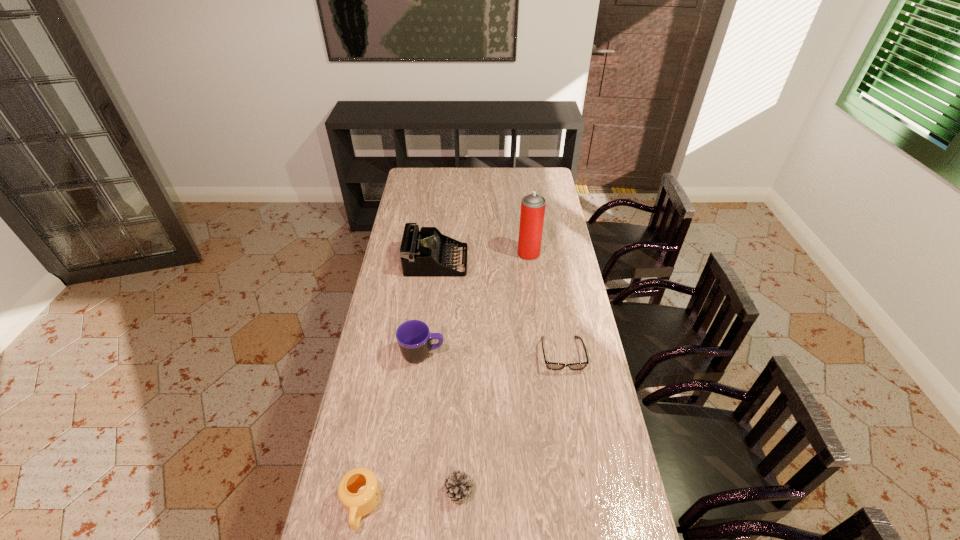
Identify the location of vacant area that lies between the fourth tallest object and the farther mug. (392, 430).

Where is `free space between the typewriter and the pinecone`? free space between the typewriter and the pinecone is located at coordinates (448, 376).

Find the location of a particular element. blank region between the farther mug and the pinecone is located at coordinates (441, 422).

Find the location of a particular element. Image resolution: width=960 pixels, height=540 pixels. free spot between the farther mug and the shortest object is located at coordinates pos(492,354).

This screenshot has width=960, height=540. What are the coordinates of `vacant space that's between the typewriter and the taller mug` in the screenshot? It's located at (429, 308).

Locate an element on the screen. free spot between the spectacles and the taller mug is located at coordinates (492, 354).

I want to click on unoccupied position between the fifth tallest object and the aerosol can, so click(494, 372).

Find the location of a particular element. Image resolution: width=960 pixels, height=540 pixels. vacant space that is in between the aerosol can and the fourth shortest object is located at coordinates (475, 304).

Identify the location of vacant space that's between the fifth tallest object and the fourth tallest object. click(411, 498).

Where is `vacant point located between the fifth tallest object and the aerosol can`? Image resolution: width=960 pixels, height=540 pixels. vacant point located between the fifth tallest object and the aerosol can is located at coordinates (494, 372).